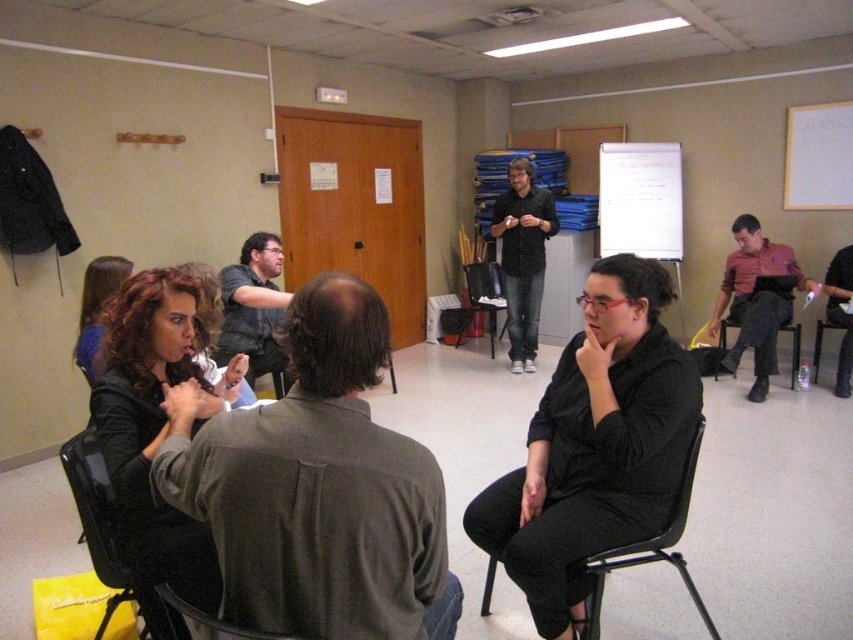
You are sitting on the black plastic chair at lower center and want to write something on the whiteboard at upper right. Which direction should you move to reach it?

The whiteboard at upper right is to the right of the black plastic chair at lower center, so you should move to your right to reach it.